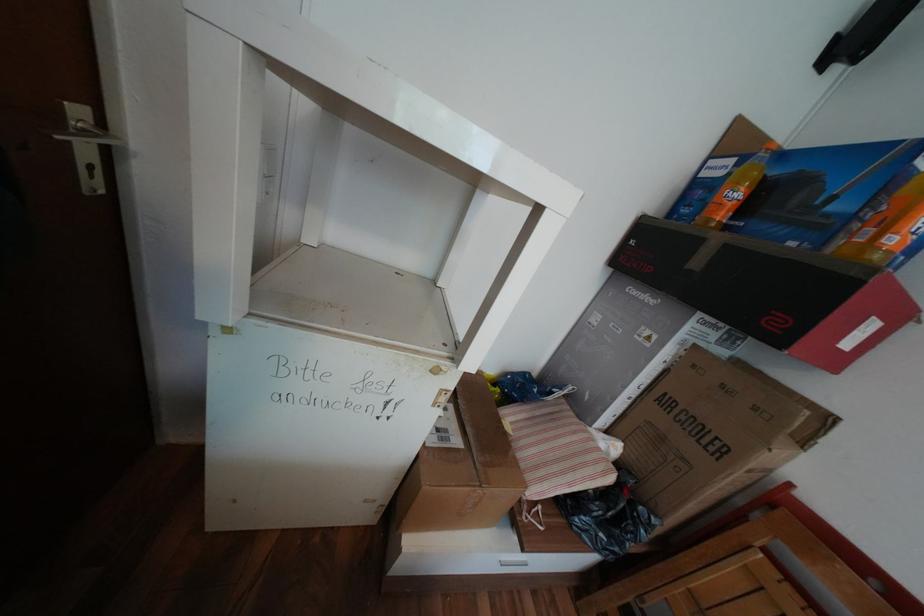
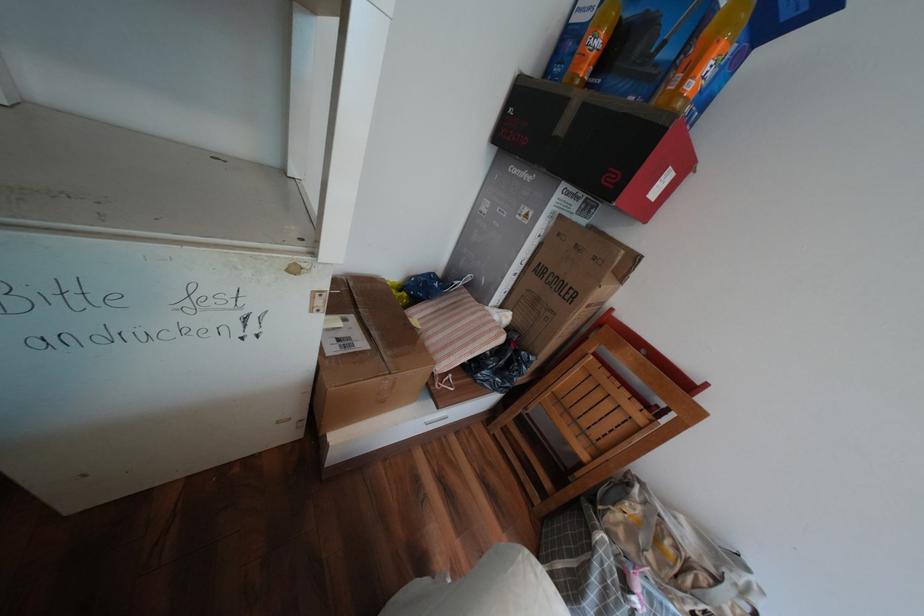
Based on the continuous images, in which direction is the camera rotating?

The rotation direction of the camera is right-down.